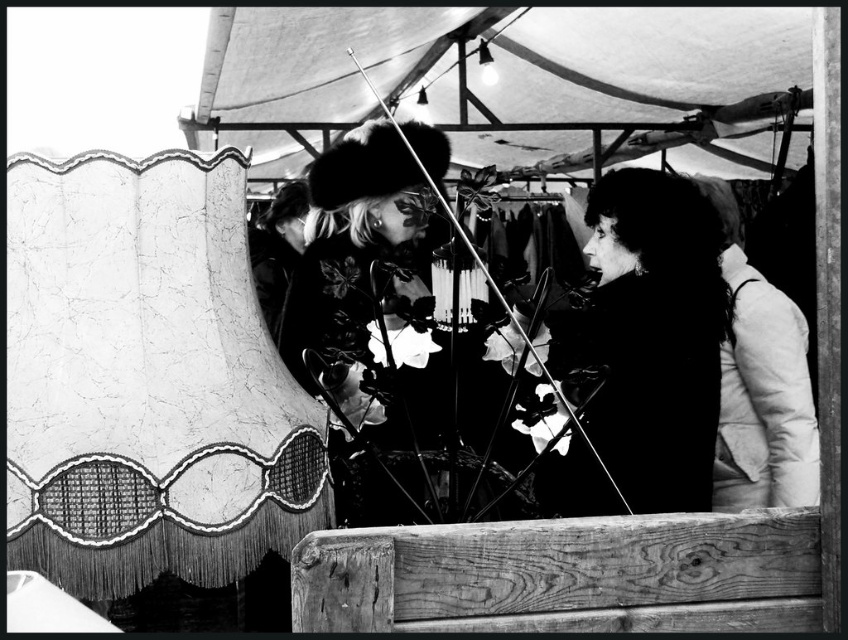
Question: Among these points, which one is nearest to the camera?

Choices:
 (A) (700, 17)
 (B) (817, 467)

Answer: (B)

Question: Can you confirm if white fabric canopy at upper center is thinner than white puffy jacket at right?

Choices:
 (A) yes
 (B) no

Answer: (B)

Question: Which of the following is the closest to the observer?

Choices:
 (A) silky black hair at center
 (B) white puffy jacket at right
 (C) white fabric canopy at upper center

Answer: (A)

Question: Which object is closer to the camera taking this photo?

Choices:
 (A) white fabric canopy at upper center
 (B) white puffy jacket at right
 (C) silky black hair at center

Answer: (C)

Question: Is white fabric canopy at upper center below silky black hair at center?

Choices:
 (A) no
 (B) yes

Answer: (A)

Question: Does white fabric canopy at upper center have a lesser width compared to white puffy jacket at right?

Choices:
 (A) no
 (B) yes

Answer: (A)